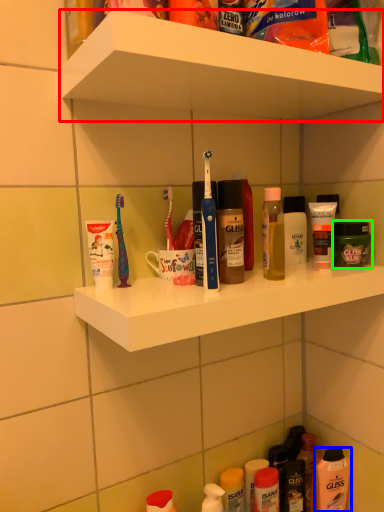
Question: Based on their relative distances, which object is nearer to supermarket shelf (highlighted by a red box)? Choose from mouthwash (highlighted by a blue box) and toiletry (highlighted by a green box).

Choices:
 (A) mouthwash
 (B) toiletry

Answer: (B)